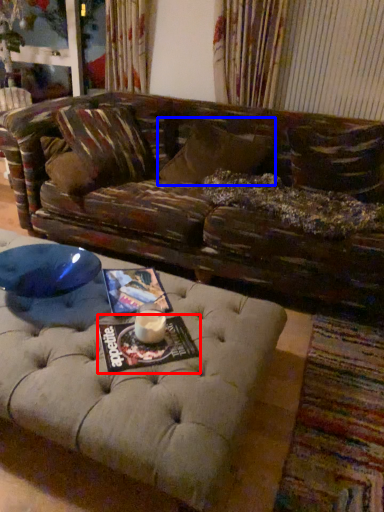
Question: Among these objects, which one is nearest to the camera, magazine (highlighted by a red box) or pillow (highlighted by a blue box)?

Choices:
 (A) magazine
 (B) pillow

Answer: (A)